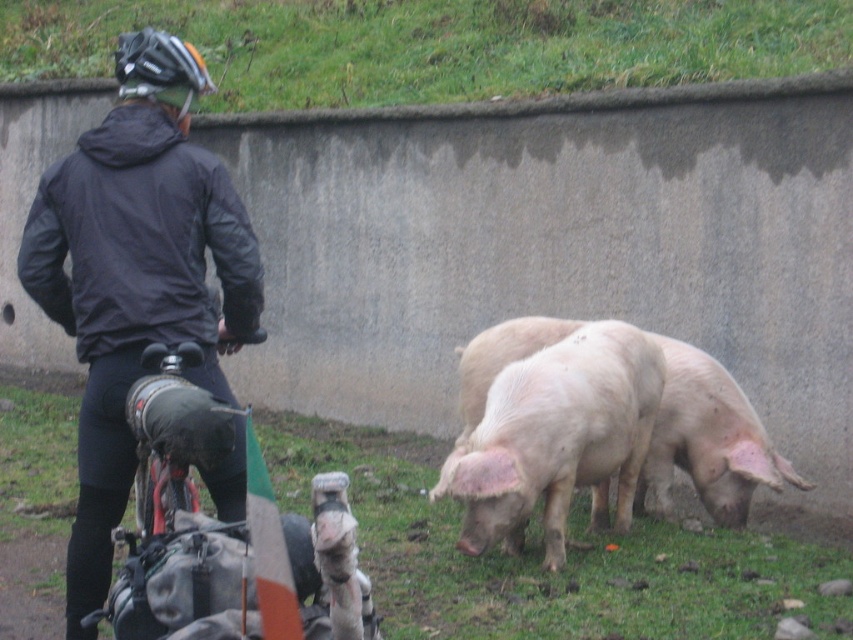
From the picture: Between green grass at upper center and matte black helmet at upper left, which one has more height?

green grass at upper center

Find the location of a particular element. Image resolution: width=853 pixels, height=640 pixels. green grass at upper center is located at coordinates click(x=434, y=44).

Identify the location of green grass at upper center. (434, 44).

Is green grass at lower center positioned in front of matte black jacket at left?

No, it is not.

Between green grass at lower center and matte black jacket at left, which one appears on the right side from the viewer's perspective?

green grass at lower center

Which is in front, point (799, 611) or point (88, 177)?

Point (88, 177)

Find the location of `green grass at lower center`. green grass at lower center is located at coordinates (540, 557).

Can you confirm if green grass at lower center is positioned to the left of pink smooth skin at center?

Indeed, green grass at lower center is positioned on the left side of pink smooth skin at center.

Between green grass at lower center and pink smooth skin at center, which one is positioned higher?

pink smooth skin at center

Who is more distant from viewer, (x=634, y=532) or (x=672, y=428)?

Point (x=672, y=428)

At what (x,y) coordinates should I click in order to perform the action: click on green grass at lower center. Please return your answer as a coordinate pair (x, y). Image resolution: width=853 pixels, height=640 pixels. Looking at the image, I should click on (540, 557).